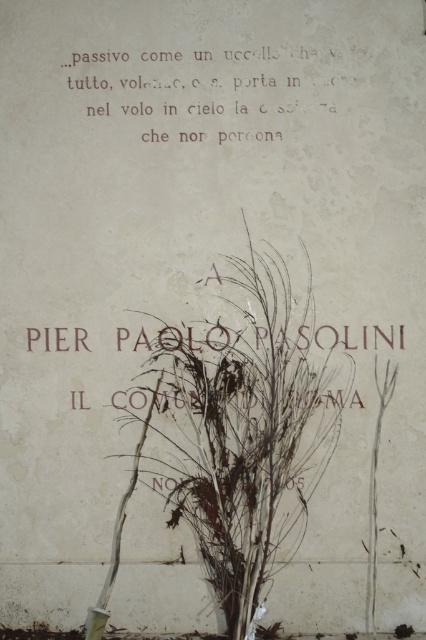
Is brown dried plant at center positioned behind matte white text at upper center?

No, it is in front of matte white text at upper center.

Is brown dried plant at center above matte white text at upper center?

Incorrect, brown dried plant at center is not positioned above matte white text at upper center.

Is point (258, 584) positioned behind point (287, 122)?

No.

Find the location of `brown dried plant at center`. brown dried plant at center is located at coordinates (247, 432).